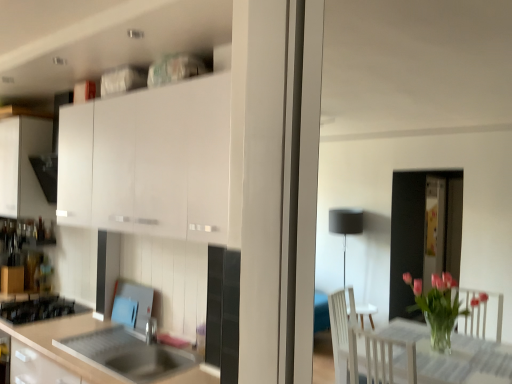
Where is `white matte cabinet at upper left, placed as the first cabinetry when sorted from right to left`? This screenshot has width=512, height=384. white matte cabinet at upper left, placed as the first cabinetry when sorted from right to left is located at coordinates (149, 162).

What is the approximate height of white matte cabinet at upper left, placed as the first cabinetry when sorted from right to left?

The height of white matte cabinet at upper left, placed as the first cabinetry when sorted from right to left, is 28.57 inches.

What do you see at coordinates (38, 308) in the screenshot? I see `black glass gas stove at lower left` at bounding box center [38, 308].

Describe the element at coordinates (23, 167) in the screenshot. The height and width of the screenshot is (384, 512). I see `matte white cabinet at left, the first cabinetry from the back` at that location.

Image resolution: width=512 pixels, height=384 pixels. Find the location of `stainless steel sink at lower left`. stainless steel sink at lower left is located at coordinates click(x=128, y=355).

Is matte white cabinet at left, arranged as the 2th cabinetry when viewed from the front, inside white matte cabinet at upper left, placed as the first cabinetry when sorted from right to left?

Actually, matte white cabinet at left, arranged as the 2th cabinetry when viewed from the front, is outside white matte cabinet at upper left, placed as the first cabinetry when sorted from right to left.

Considering the positions of objects white matte cabinet at upper left, placed as the first cabinetry when sorted from right to left, and matte white cabinet at left, the first cabinetry from the back, in the image provided, who is in front, white matte cabinet at upper left, placed as the first cabinetry when sorted from right to left, or matte white cabinet at left, the first cabinetry from the back,?

white matte cabinet at upper left, placed as the first cabinetry when sorted from right to left.

From a real-world perspective, is white matte cabinet at upper left, which ranks as the first cabinetry in front-to-back order, positioned above or below matte white cabinet at left, placed as the first cabinetry when sorted from left to right?

Clearly, from a real-world perspective, white matte cabinet at upper left, which ranks as the first cabinetry in front-to-back order, is above matte white cabinet at left, placed as the first cabinetry when sorted from left to right.

From the image's perspective, is white matte cabinet at upper left, which ranks as the 2th cabinetry in left-to-right order, under matte white cabinet at left, arranged as the 2th cabinetry when viewed from the front?

Yes, from the image's perspective, white matte cabinet at upper left, which ranks as the 2th cabinetry in left-to-right order, is beneath matte white cabinet at left, arranged as the 2th cabinetry when viewed from the front.

Looking at this image, can you tell me how much matte white cabinet at left, arranged as the 2th cabinetry when viewed from the front, and stainless steel sink at lower left differ in facing direction?

1.46 degrees separate the facing orientations of matte white cabinet at left, arranged as the 2th cabinetry when viewed from the front, and stainless steel sink at lower left.

Which object is closer to the camera taking this photo, matte white cabinet at left, arranged as the 2th cabinetry when viewed from the front, or stainless steel sink at lower left?

stainless steel sink at lower left is closer to the camera.

Can you see matte white cabinet at left, which appears as the second cabinetry when viewed from the right, touching stainless steel sink at lower left?

No, matte white cabinet at left, which appears as the second cabinetry when viewed from the right, is not with stainless steel sink at lower left.

Is stainless steel sink at lower left inside matte white cabinet at left, the first cabinetry from the back?

Actually, stainless steel sink at lower left is outside matte white cabinet at left, the first cabinetry from the back.

Considering the relative sizes of matte white cabinet at left, placed as the first cabinetry when sorted from left to right, and black glass gas stove at lower left in the image provided, is matte white cabinet at left, placed as the first cabinetry when sorted from left to right, taller than black glass gas stove at lower left?

Yes.

Between matte white cabinet at left, placed as the first cabinetry when sorted from left to right, and black glass gas stove at lower left, which one has larger width?

black glass gas stove at lower left is wider.

Is matte white cabinet at left, which appears as the second cabinetry when viewed from the right, positioned far away from black glass gas stove at lower left?

That's not correct — matte white cabinet at left, which appears as the second cabinetry when viewed from the right, is a little close to black glass gas stove at lower left.

From a real-world perspective, does matte white cabinet at left, the first cabinetry from the back, sit lower than black glass gas stove at lower left?

No, from a real-world perspective, matte white cabinet at left, the first cabinetry from the back, is not beneath black glass gas stove at lower left.

Is white matte cabinet at upper left, placed as the 2th cabinetry when sorted from back to front, inside black glass gas stove at lower left?

Definitely not — white matte cabinet at upper left, placed as the 2th cabinetry when sorted from back to front, is not inside black glass gas stove at lower left.

Which of these two, black glass gas stove at lower left or white matte cabinet at upper left, placed as the first cabinetry when sorted from right to left, is wider?

black glass gas stove at lower left.

Is black glass gas stove at lower left bigger than white matte cabinet at upper left, which ranks as the 2th cabinetry in left-to-right order?

Actually, black glass gas stove at lower left might be smaller than white matte cabinet at upper left, which ranks as the 2th cabinetry in left-to-right order.

Looking at this image, from a real-world perspective, is black glass gas stove at lower left on top of white matte cabinet at upper left, which ranks as the 2th cabinetry in left-to-right order?

No, from a real-world perspective, black glass gas stove at lower left is not over white matte cabinet at upper left, which ranks as the 2th cabinetry in left-to-right order

From the picture: From the image's perspective, is stainless steel sink at lower left on white matte cabinet at upper left, placed as the 2th cabinetry when sorted from back to front?

No, from the image's perspective, stainless steel sink at lower left is not above white matte cabinet at upper left, placed as the 2th cabinetry when sorted from back to front.

I want to click on sink located underneath the white matte cabinet at upper left, placed as the 2th cabinetry when sorted from back to front (from a real-world perspective), so click(128, 355).

Is white matte cabinet at upper left, placed as the first cabinetry when sorted from right to left, in front of or behind stainless steel sink at lower left in the image?

Clearly, white matte cabinet at upper left, placed as the first cabinetry when sorted from right to left, is in front of stainless steel sink at lower left.

Is point (199, 174) closer or farther from the camera than point (61, 340)?

Clearly, point (199, 174) is closer to the camera than point (61, 340).

Looking at this image, is white matte cabinet at upper left, placed as the first cabinetry when sorted from right to left, taller or shorter than stainless steel sink at lower left?

In the image, white matte cabinet at upper left, placed as the first cabinetry when sorted from right to left, appears to be taller than stainless steel sink at lower left.

In the scene shown: From a real-world perspective, is black glass gas stove at lower left positioned under matte white cabinet at left, the first cabinetry from the back, based on gravity?

Correct, in the physical world, black glass gas stove at lower left is lower than matte white cabinet at left, the first cabinetry from the back.

Considering the sizes of black glass gas stove at lower left and matte white cabinet at left, placed as the first cabinetry when sorted from left to right, in the image, is black glass gas stove at lower left bigger or smaller than matte white cabinet at left, placed as the first cabinetry when sorted from left to right,?

In the image, black glass gas stove at lower left appears to be smaller than matte white cabinet at left, placed as the first cabinetry when sorted from left to right.

Are black glass gas stove at lower left and matte white cabinet at left, which appears as the second cabinetry when viewed from the right, beside each other?

black glass gas stove at lower left is not next to matte white cabinet at left, which appears as the second cabinetry when viewed from the right, and they're not touching.

Based on the photo, how different are the orientations of black glass gas stove at lower left and matte white cabinet at left, the first cabinetry from the back, in degrees?

1.46 degrees.

Where is `cabinetry in front of the matte white cabinet at left, placed as the first cabinetry when sorted from left to right`? This screenshot has width=512, height=384. cabinetry in front of the matte white cabinet at left, placed as the first cabinetry when sorted from left to right is located at coordinates (149, 162).

The width and height of the screenshot is (512, 384). In order to click on cabinetry on the left of stainless steel sink at lower left in this screenshot , I will do `click(23, 167)`.

Based on their spatial positions, is black glass gas stove at lower left or matte white cabinet at left, which appears as the second cabinetry when viewed from the right, closer to stainless steel sink at lower left?

black glass gas stove at lower left is positioned closer to the anchor stainless steel sink at lower left.

From the image, which object appears to be farther from black glass gas stove at lower left, matte white cabinet at left, placed as the first cabinetry when sorted from left to right, or stainless steel sink at lower left?

Among the two, matte white cabinet at left, placed as the first cabinetry when sorted from left to right, is located further to black glass gas stove at lower left.

When comparing their distances from stainless steel sink at lower left, does matte white cabinet at left, the first cabinetry from the back, or black glass gas stove at lower left seem closer?

The object closer to stainless steel sink at lower left is black glass gas stove at lower left.

Based on their spatial positions, is white matte cabinet at upper left, which ranks as the 2th cabinetry in left-to-right order, or matte white cabinet at left, placed as the first cabinetry when sorted from left to right, further from stainless steel sink at lower left?

matte white cabinet at left, placed as the first cabinetry when sorted from left to right, is further to stainless steel sink at lower left.

Estimate the real-world distances between objects in this image. Which object is further from matte white cabinet at left, arranged as the 2th cabinetry when viewed from the front, stainless steel sink at lower left or black glass gas stove at lower left?

stainless steel sink at lower left.

Estimate the real-world distances between objects in this image. Which object is further from black glass gas stove at lower left, white matte cabinet at upper left, placed as the first cabinetry when sorted from right to left, or matte white cabinet at left, which appears as the second cabinetry when viewed from the right?

Based on the image, white matte cabinet at upper left, placed as the first cabinetry when sorted from right to left, appears to be further to black glass gas stove at lower left.

Based on their spatial positions, is white matte cabinet at upper left, placed as the first cabinetry when sorted from right to left, or black glass gas stove at lower left closer to stainless steel sink at lower left?

black glass gas stove at lower left is closer to stainless steel sink at lower left.

From the image, which object appears to be farther from white matte cabinet at upper left, which ranks as the first cabinetry in front-to-back order, matte white cabinet at left, the first cabinetry from the back, or black glass gas stove at lower left?

black glass gas stove at lower left is further to white matte cabinet at upper left, which ranks as the first cabinetry in front-to-back order.

The width and height of the screenshot is (512, 384). In order to click on gas stove between matte white cabinet at left, arranged as the 2th cabinetry when viewed from the front, and white matte cabinet at upper left, placed as the 2th cabinetry when sorted from back to front, from left to right in this screenshot , I will do `click(38, 308)`.

You are a GUI agent. You are given a task and a screenshot of the screen. Output one action in this format:
    pyautogui.click(x=<x>, y=<y>)
    Task: Click on the gas stove between white matte cabinet at upper left, placed as the 2th cabinetry when sorted from back to front, and stainless steel sink at lower left vertically
    The height and width of the screenshot is (384, 512).
    Given the screenshot: What is the action you would take?
    pyautogui.click(x=38, y=308)

Find the location of a particular element. Image resolution: width=512 pixels, height=384 pixels. sink between matte white cabinet at left, the first cabinetry from the back, and white matte cabinet at upper left, which ranks as the 2th cabinetry in left-to-right order, from left to right is located at coordinates (128, 355).

Find the location of a particular element. gas stove between matte white cabinet at left, arranged as the 2th cabinetry when viewed from the front, and stainless steel sink at lower left, in the horizontal direction is located at coordinates click(x=38, y=308).